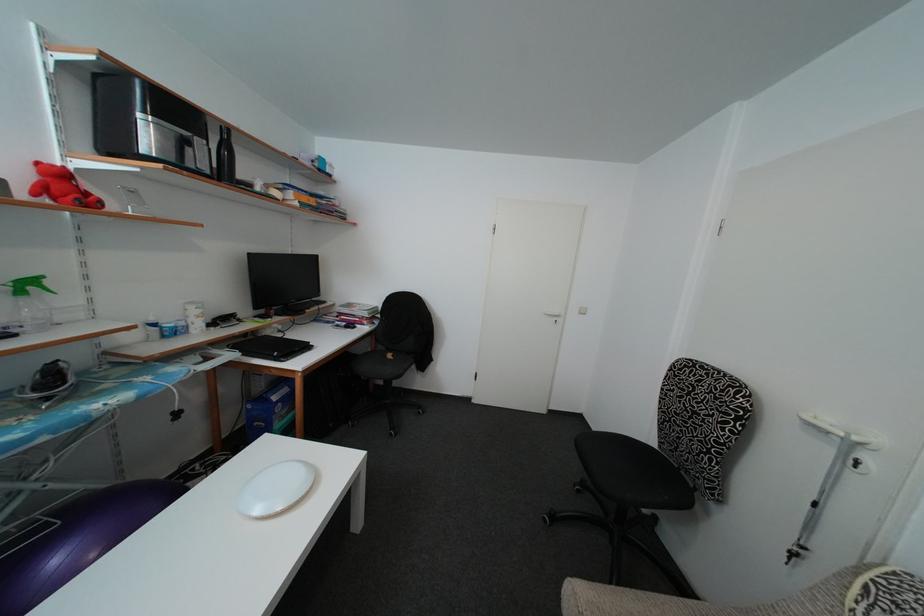
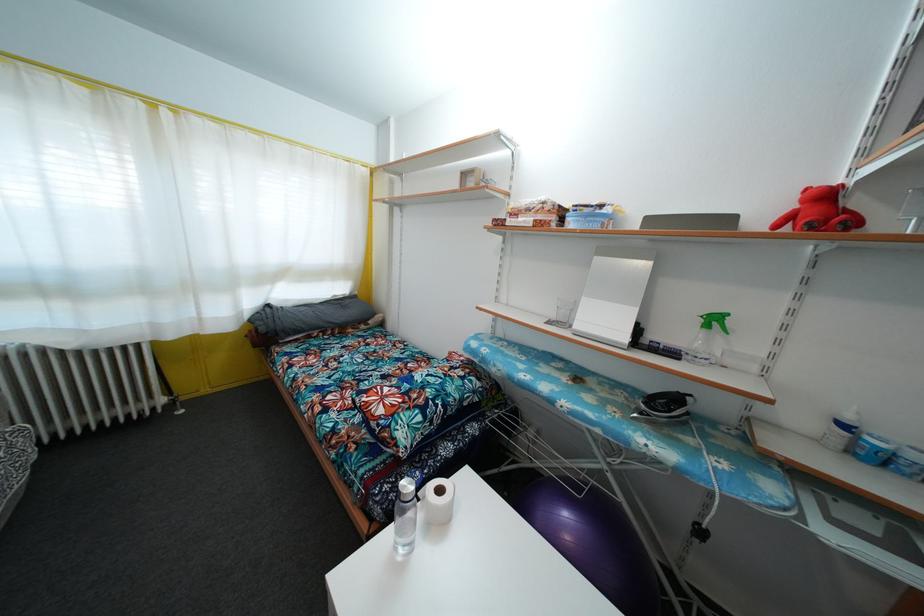
Find the pixel in the second image that matches point 180,421 in the first image.

(704, 540)